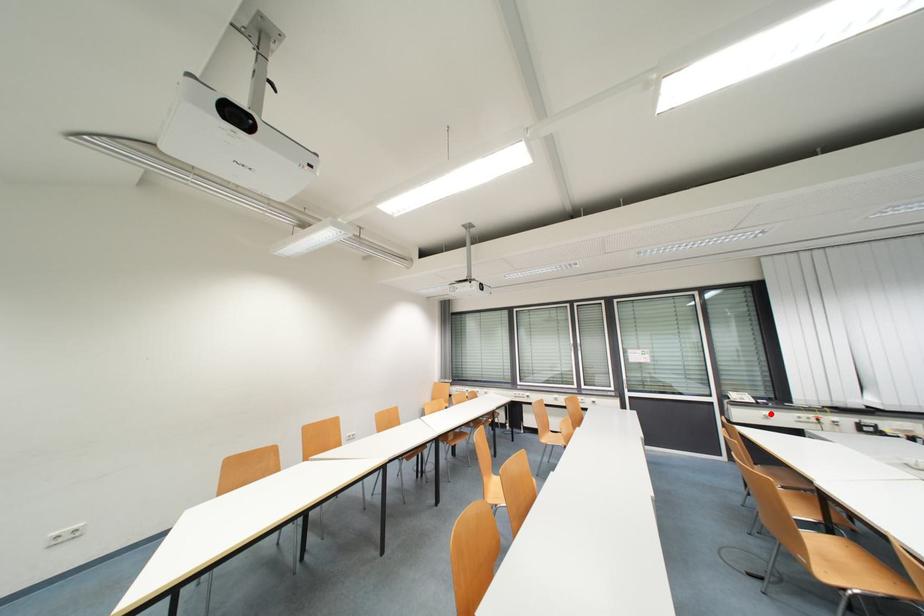
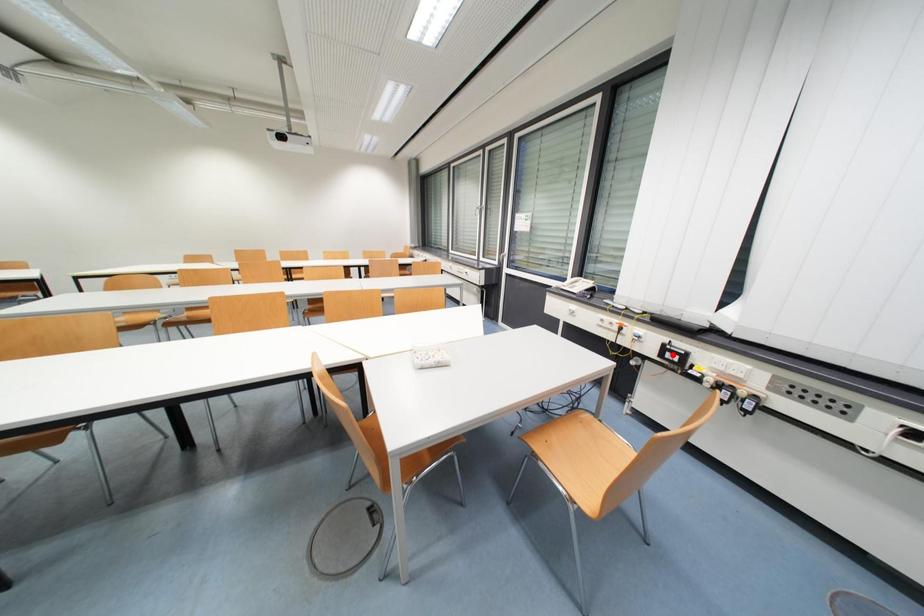
I am providing you with two images of the same scene from different viewpoints. A red point is marked on the first image and another point is marked on the second image. Does the point marked in image1 correspond to the same location as the one in image2?

No